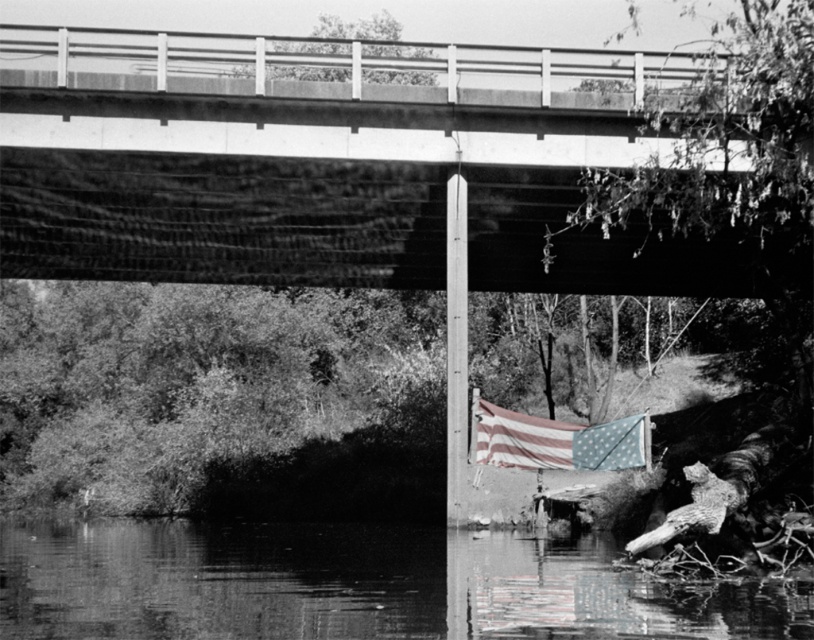
Question: Which point appears closest to the camera in this image?

Choices:
 (A) (598, 440)
 (B) (174, 636)

Answer: (B)

Question: Does smooth water at lower center have a lesser width compared to american flag at lower right?

Choices:
 (A) yes
 (B) no

Answer: (B)

Question: From the image, what is the correct spatial relationship of smooth water at lower center in relation to american flag at lower right?

Choices:
 (A) above
 (B) below

Answer: (B)

Question: Is smooth water at lower center to the left of american flag at lower right from the viewer's perspective?

Choices:
 (A) yes
 (B) no

Answer: (A)